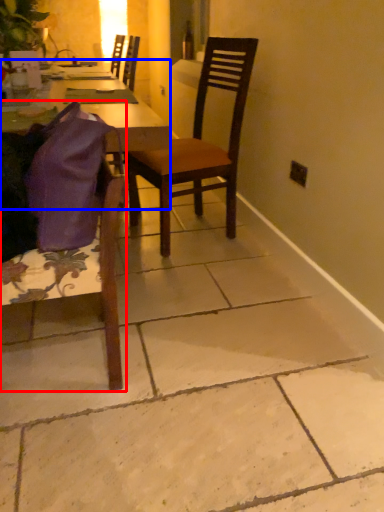
Question: Which point is further to the camera, chair (highlighted by a red box) or desk (highlighted by a blue box)?

Choices:
 (A) chair
 (B) desk

Answer: (B)